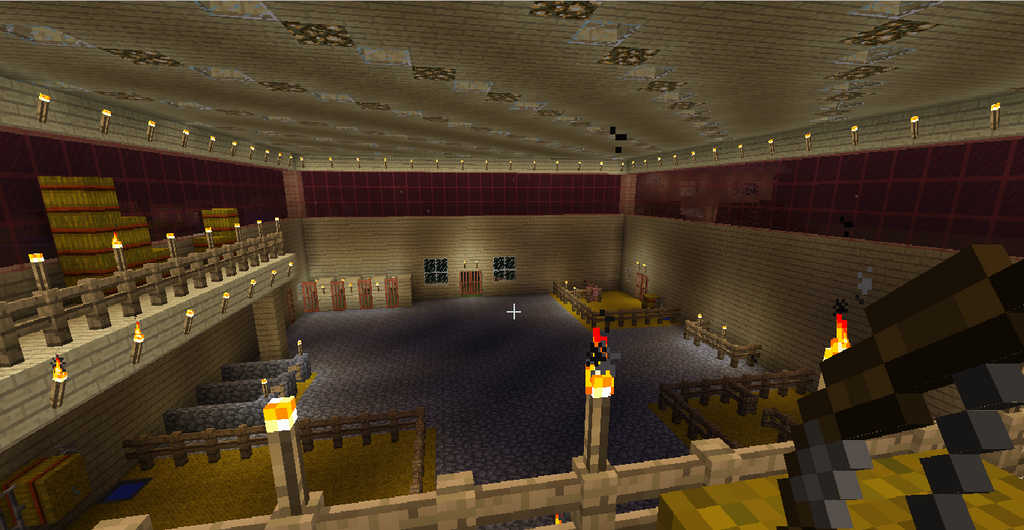
You are a GUI agent. You are given a task and a screenshot of the screen. Output one action in this format:
    pyautogui.click(x=<x>, y=<y>)
    Task: Click on the floor
    The image size is (1024, 530).
    Given the screenshot: What is the action you would take?
    pyautogui.click(x=489, y=381)